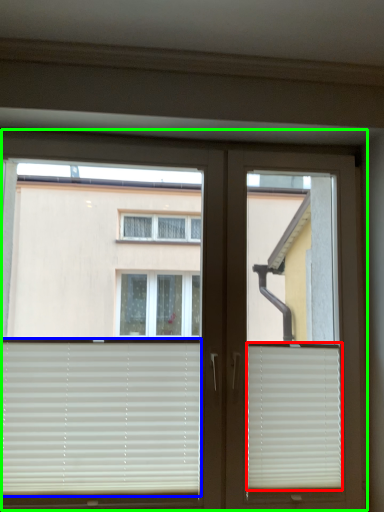
Question: Considering the real-world distances, which object is farthest from window blind (highlighted by a red box)? window blind (highlighted by a blue box) or window (highlighted by a green box)?

Choices:
 (A) window blind
 (B) window

Answer: (A)